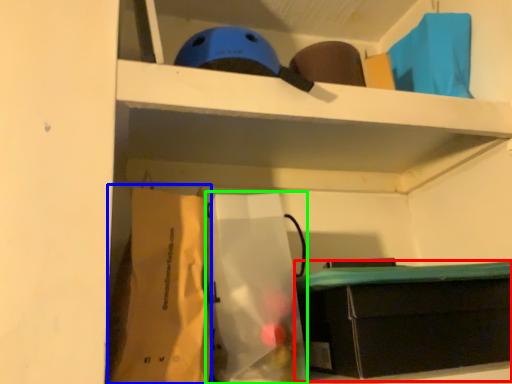
Question: Which is nearer to the furniture (highlighted by a red box)? paper bag (highlighted by a blue box) or paper bag (highlighted by a green box).

Choices:
 (A) paper bag
 (B) paper bag

Answer: (B)